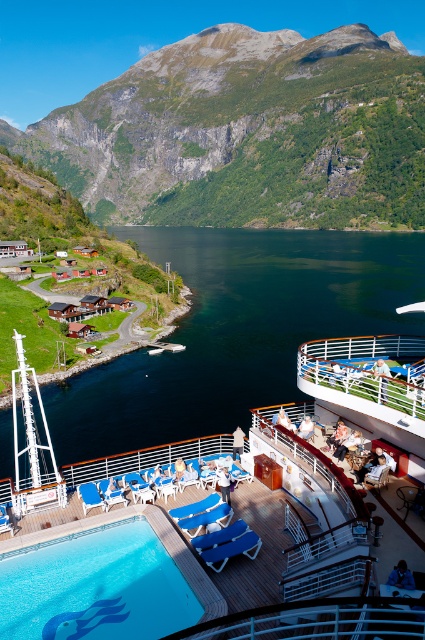
Which is behind, point (215, 76) or point (413, 317)?

The point (215, 76) is more distant.

Between green textured mountain at upper left and dark blue water at center, which one is positioned higher?

Positioned higher is green textured mountain at upper left.

This screenshot has height=640, width=425. What do you see at coordinates (248, 132) in the screenshot? I see `green textured mountain at upper left` at bounding box center [248, 132].

At what (x,y) coordinates should I click in order to perform the action: click on green textured mountain at upper left. Please return your answer as a coordinate pair (x, y). Image resolution: width=425 pixels, height=640 pixels. Looking at the image, I should click on (248, 132).

Is dark blue water at center thinner than blue glossy pool at lower left?

No, dark blue water at center is not thinner than blue glossy pool at lower left.

Which is more to the right, dark blue water at center or blue glossy pool at lower left?

dark blue water at center

This screenshot has width=425, height=640. Describe the element at coordinates (237, 332) in the screenshot. I see `dark blue water at center` at that location.

Locate an element on the screen. The image size is (425, 640). dark blue water at center is located at coordinates (237, 332).

Based on the photo, between green textured mountain at upper left and blue glossy pool at lower left, which one is positioned higher?

green textured mountain at upper left is above.

Is green textured mountain at upper left thinner than blue glossy pool at lower left?

No.

You are a GUI agent. You are given a task and a screenshot of the screen. Output one action in this format:
    pyautogui.click(x=<x>, y=<y>)
    Task: Click on the green textured mountain at upper left
    The width and height of the screenshot is (425, 640).
    Given the screenshot: What is the action you would take?
    [x=248, y=132]